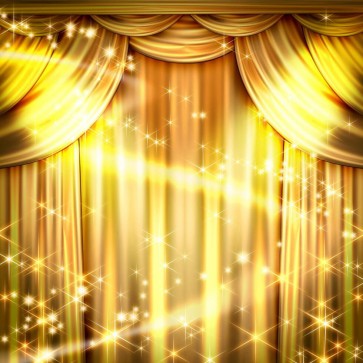
Locate an element on the screen. left curtain is located at coordinates 41,243.